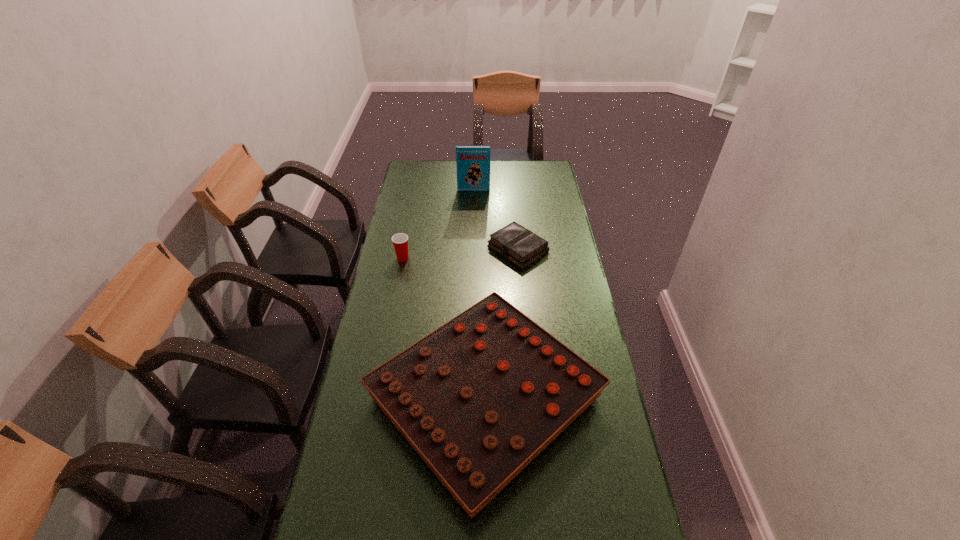
The width and height of the screenshot is (960, 540). Find the location of `the tallest object`. the tallest object is located at coordinates (472, 162).

Identify the location of the taller book. (472, 162).

The width and height of the screenshot is (960, 540). I want to click on Dixie cup, so click(x=400, y=241).

This screenshot has height=540, width=960. What are the coordinates of `the nearest object` in the screenshot? It's located at (479, 398).

Where is `the shortest object`? Image resolution: width=960 pixels, height=540 pixels. the shortest object is located at coordinates (514, 242).

Locate an element on the screen. This screenshot has width=960, height=540. the nearer book is located at coordinates (514, 242).

This screenshot has width=960, height=540. Find the location of `vacant space situated 0.310m on the front cover of the taller book`. vacant space situated 0.310m on the front cover of the taller book is located at coordinates (473, 231).

I want to click on free space located on the back of the Dixie cup, so click(x=415, y=198).

You are a GUI agent. You are given a task and a screenshot of the screen. Output one action in this format:
    pyautogui.click(x=<x>, y=<y>)
    Task: Click on the vacant space situated on the back of the nearest object
    This screenshot has height=540, width=960.
    Given the screenshot: What is the action you would take?
    pyautogui.click(x=484, y=249)

What are the coordinates of `vacant point located 0.310m on the front of the shorter book` in the screenshot? It's located at (526, 332).